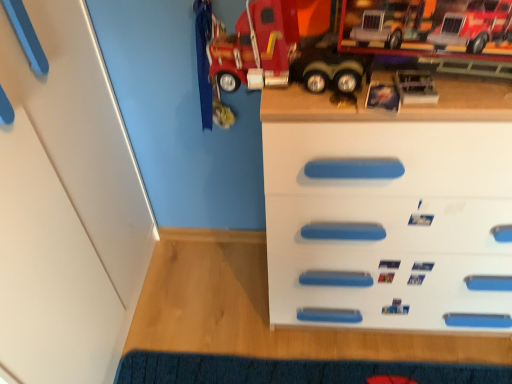
Question: Is white plastic chest of drawers at center directly adjacent to blue textured mat at lower center?

Choices:
 (A) yes
 (B) no

Answer: (B)

Question: Can you confirm if white plastic chest of drawers at center is wider than blue textured mat at lower center?

Choices:
 (A) yes
 (B) no

Answer: (A)

Question: Is white plastic chest of drawers at center aimed at blue textured mat at lower center?

Choices:
 (A) yes
 (B) no

Answer: (A)

Question: From a real-world perspective, does white plastic chest of drawers at center sit lower than blue textured mat at lower center?

Choices:
 (A) yes
 (B) no

Answer: (B)

Question: From a real-world perspective, is white plastic chest of drawers at center physically above blue textured mat at lower center?

Choices:
 (A) yes
 (B) no

Answer: (A)

Question: Are white plastic chest of drawers at center and blue textured mat at lower center located far from each other?

Choices:
 (A) yes
 (B) no

Answer: (B)

Question: Can you confirm if blue textured mat at lower center is smaller than white plastic chest of drawers at center?

Choices:
 (A) no
 (B) yes

Answer: (B)

Question: Is blue textured mat at lower center facing towards white plastic chest of drawers at center?

Choices:
 (A) yes
 (B) no

Answer: (A)

Question: From the image's perspective, is blue textured mat at lower center located beneath white plastic chest of drawers at center?

Choices:
 (A) no
 (B) yes

Answer: (B)

Question: Is the position of blue textured mat at lower center less distant than that of white plastic chest of drawers at center?

Choices:
 (A) yes
 (B) no

Answer: (B)

Question: Considering the relative sizes of blue textured mat at lower center and white plastic chest of drawers at center in the image provided, is blue textured mat at lower center shorter than white plastic chest of drawers at center?

Choices:
 (A) no
 (B) yes

Answer: (B)

Question: Does blue textured mat at lower center appear on the right side of white plastic chest of drawers at center?

Choices:
 (A) no
 (B) yes

Answer: (A)

Question: Looking at their shapes, would you say white plastic chest of drawers at center is wider or thinner than blue textured mat at lower center?

Choices:
 (A) thin
 (B) wide

Answer: (B)